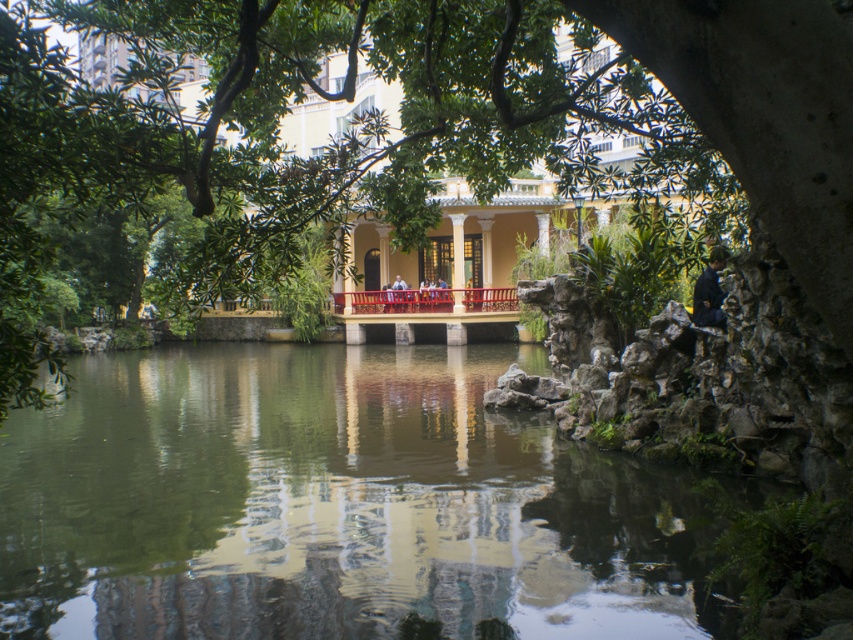
Question: Which point is farther to the camera?

Choices:
 (A) metallic red railing at center
 (B) green reflective water at center

Answer: (A)

Question: Among these objects, which one is farthest from the camera?

Choices:
 (A) metallic red railing at center
 (B) green reflective water at center

Answer: (A)

Question: Does green reflective water at center have a larger size compared to metallic red railing at center?

Choices:
 (A) yes
 (B) no

Answer: (A)

Question: Does green reflective water at center have a smaller size compared to metallic red railing at center?

Choices:
 (A) yes
 (B) no

Answer: (B)

Question: Which point appears closest to the camera in this image?

Choices:
 (A) (459, 508)
 (B) (473, 300)

Answer: (A)

Question: Is the position of green reflective water at center more distant than that of metallic red railing at center?

Choices:
 (A) no
 (B) yes

Answer: (A)